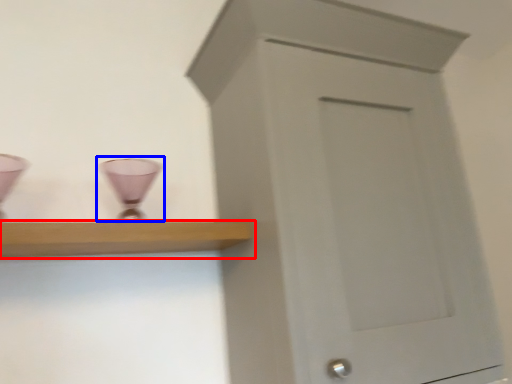
Question: Which of the following is the closest to the observer, shelf (highlighted by a red box) or candle holder (highlighted by a blue box)?

Choices:
 (A) shelf
 (B) candle holder

Answer: (A)